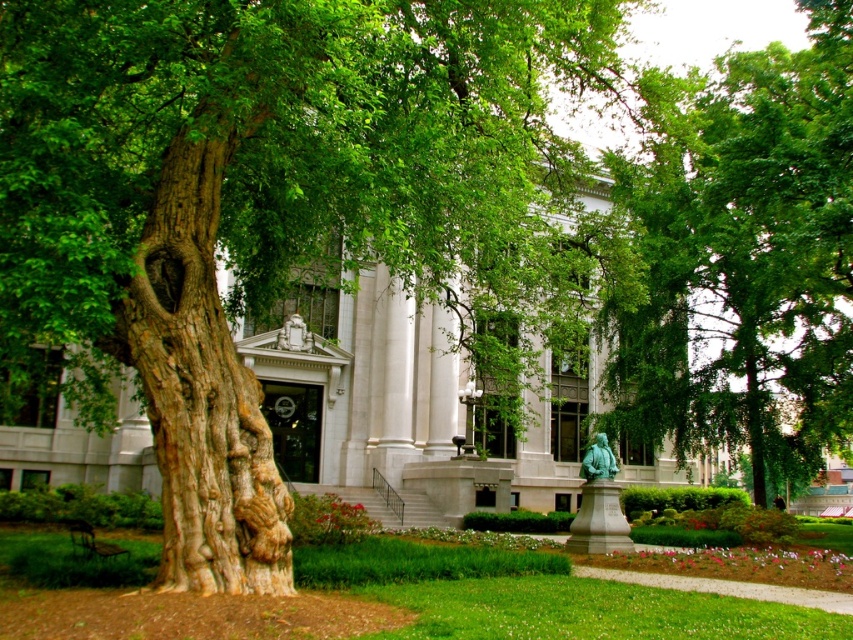
Question: Is green leafy tree at center positioned in front of green marble statue at center?

Choices:
 (A) no
 (B) yes

Answer: (B)

Question: Which of the following is the closest to the observer?

Choices:
 (A) (x=751, y=230)
 (B) (x=294, y=330)
 (C) (x=473, y=314)
 (D) (x=589, y=452)

Answer: (D)

Question: Which object appears closest to the camera in this image?

Choices:
 (A) green rough bark tree at left
 (B) green leafy tree at center
 (C) green marble statue at center
 (D) green patina statue at center

Answer: (A)

Question: Does green rough bark tree at left lie behind green leafy tree at center?

Choices:
 (A) yes
 (B) no

Answer: (B)

Question: Does green rough bark tree at left lie in front of green patina statue at center?

Choices:
 (A) no
 (B) yes

Answer: (B)

Question: Among these objects, which one is farthest from the camera?

Choices:
 (A) green leafy tree at center
 (B) green marble statue at center
 (C) green rough bark tree at left

Answer: (B)